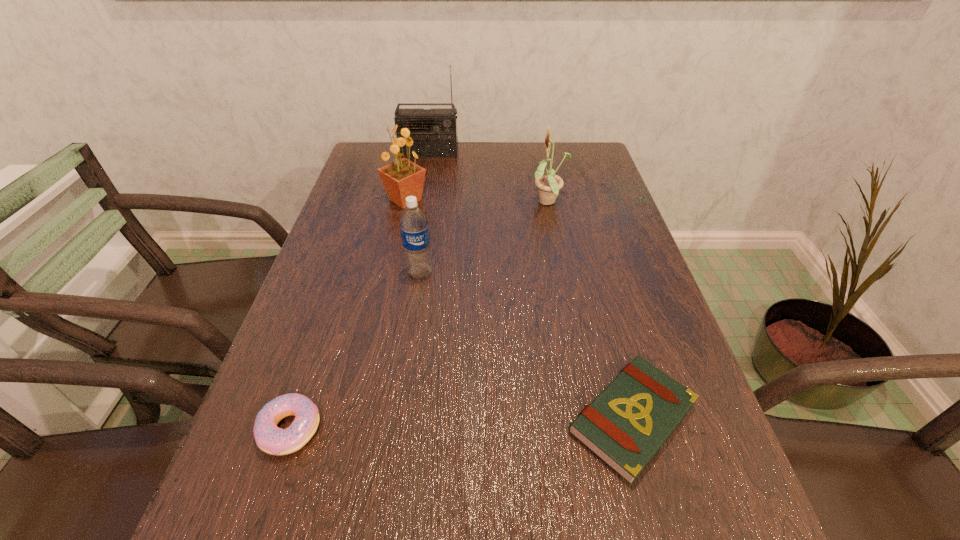
Image resolution: width=960 pixels, height=540 pixels. Identify the location of free space located on the front-facing side of the right sunflower. (444, 203).

You are a GUI agent. You are given a task and a screenshot of the screen. Output one action in this format:
    pyautogui.click(x=<x>, y=<y>)
    Task: Click on the vacant space situated 0.100m on the front-facing side of the right sunflower
    
    Given the screenshot: What is the action you would take?
    pyautogui.click(x=493, y=203)

At what (x,y) coordinates should I click in order to perform the action: click on vacant space located on the left of the water bottle. Please return your answer as a coordinate pair (x, y). Image resolution: width=960 pixels, height=540 pixels. Looking at the image, I should click on (320, 273).

The image size is (960, 540). Identify the location of vacant position located on the right of the doughnut. 452,429.

The width and height of the screenshot is (960, 540). Identify the location of free spot located on the left of the book. (459, 418).

Identify the location of object located at the far edge. tap(435, 133).

Locate an element on the screen. This screenshot has height=540, width=960. radio receiver present at the left edge is located at coordinates (435, 133).

At what (x,y) coordinates should I click in order to perform the action: click on sunflower at the left edge. Please return your answer as a coordinate pair (x, y). The height and width of the screenshot is (540, 960). Looking at the image, I should click on (402, 178).

Image resolution: width=960 pixels, height=540 pixels. I want to click on doughnut positioned at the left edge, so click(x=271, y=439).

You are a GUI agent. You are given a task and a screenshot of the screen. Output one action in this format:
    pyautogui.click(x=<x>, y=<y>)
    Task: Click on the sunflower situated at the right edge
    This screenshot has height=540, width=960.
    Given the screenshot: What is the action you would take?
    pyautogui.click(x=549, y=184)